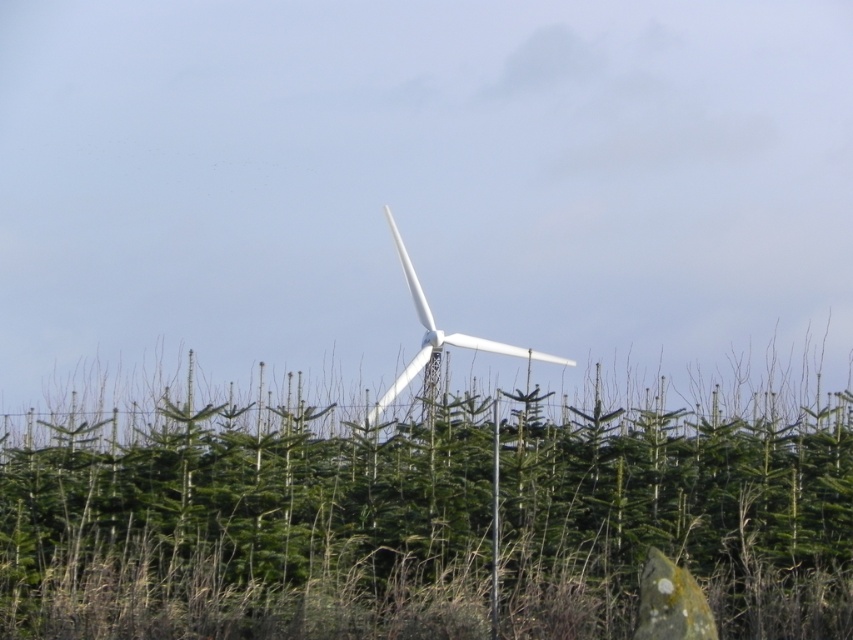
You are standing in the forest and want to take a photo of the green matte tree at center and the white matte wind turbine at center. Which object will appear larger in the photo?

The green matte tree at center will appear larger in the photo because it is closer to the viewer than the white matte wind turbine at center.

You are a bird flying over a forest and see the green matte tree at center and the white matte wind turbine at center. Which one is taller?

The white matte wind turbine at center is taller than the green matte tree at center.

You are a photographer planning to capture a wide landscape shot of the green matte tree at center and the white matte wind turbine at center. Based on their sizes, which object should you focus on to ensure it fills more of the frame?

The green matte tree at center has a larger width than the white matte wind turbine at center, so focusing on the green matte tree at center will ensure it fills more of the frame.